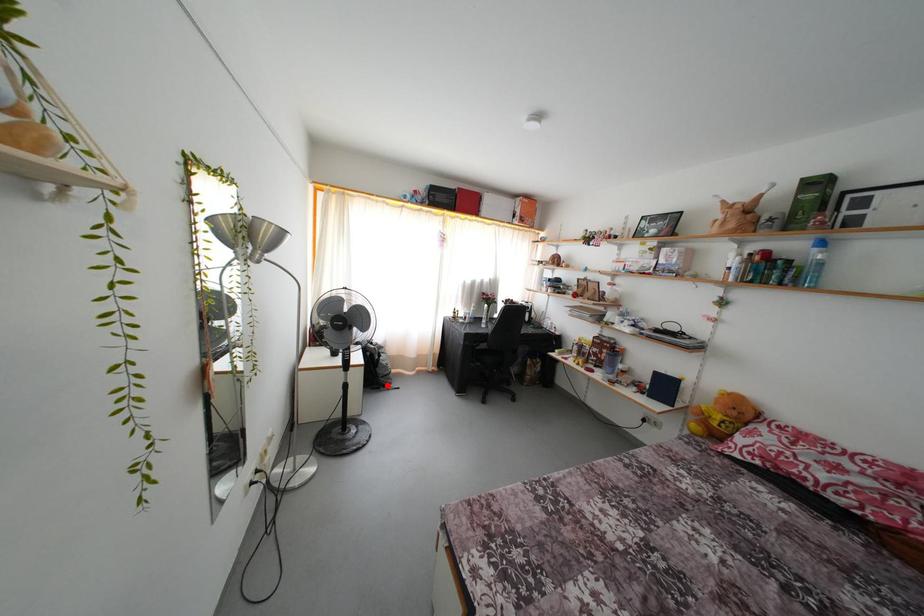
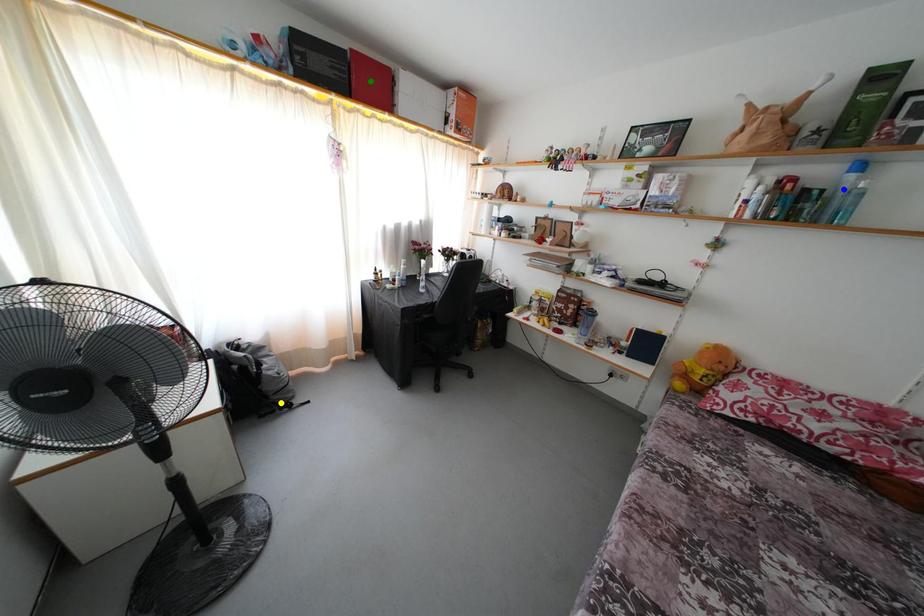
Question: I am providing you with two images of the same scene from different viewpoints. A red point is marked on the first image. You are given multiple points on the second image. Which point in image 2 represents the same 3d spot as the red point in image 1?

Choices:
 (A) yellow point
 (B) blue point
 (C) green point

Answer: (A)